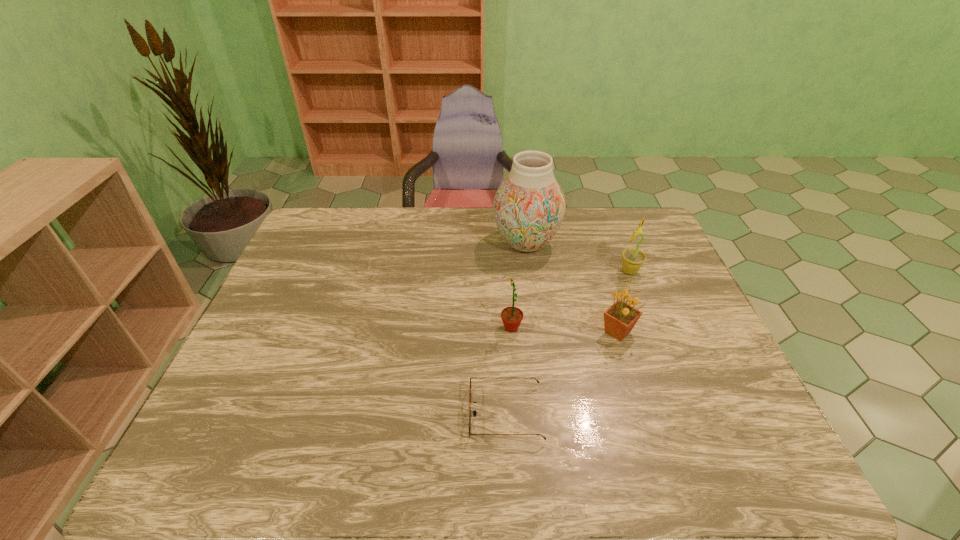
Find the location of a particular element. The image size is (960, 540). free space that is in between the farthest sunflower and the sunglasses is located at coordinates (567, 342).

Find the location of `free space between the rightmost sunflower and the sunglasses`. free space between the rightmost sunflower and the sunglasses is located at coordinates (567, 342).

Locate an element on the screen. The height and width of the screenshot is (540, 960). free space between the second object from right to left and the leftmost sunflower is located at coordinates (564, 330).

This screenshot has width=960, height=540. What are the coordinates of `free area in between the tallest object and the leftmost sunflower` in the screenshot? It's located at (518, 286).

Locate an element on the screen. The height and width of the screenshot is (540, 960). the fourth closest object to the tallest object is located at coordinates (474, 412).

Where is `the fourth closest object relative to the rightmost sunflower`? the fourth closest object relative to the rightmost sunflower is located at coordinates (474, 412).

Point out which sunflower is positioned as the second nearest to the leftmost sunflower. Please provide its 2D coordinates. Your answer should be formatted as a tuple, i.e. [(x, y)], where the tuple contains the x and y coordinates of a point satisfying the conditions above.

[(632, 259)]

Select which sunflower appears as the second closest to the vase. Please provide its 2D coordinates. Your answer should be formatted as a tuple, i.e. [(x, y)], where the tuple contains the x and y coordinates of a point satisfying the conditions above.

[(619, 319)]

Where is `vacant space that satisfies the following two spatial constraints: 1. on the front side of the tallest object; 2. on the front-facing side of the nearest object`? This screenshot has height=540, width=960. vacant space that satisfies the following two spatial constraints: 1. on the front side of the tallest object; 2. on the front-facing side of the nearest object is located at coordinates pos(548,414).